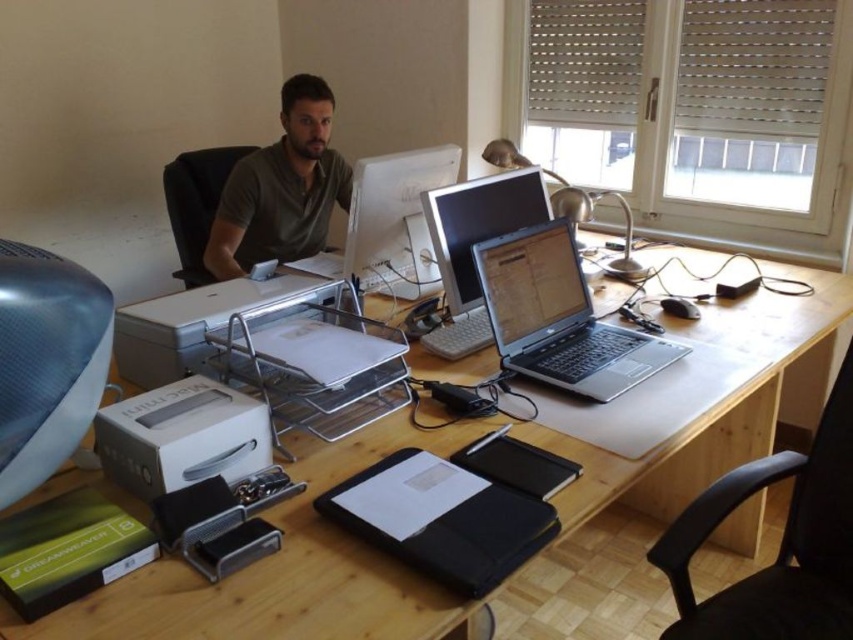
Between point (767, 570) and point (103, 470), which one is positioned behind?

The point (767, 570) is behind.

Is black leather chair at lower right wider than white plastic printer at lower left?

Yes, black leather chair at lower right is wider than white plastic printer at lower left.

Is point (717, 490) behind point (112, 406)?

Yes, it is.

Find the location of a particular element. This screenshot has width=853, height=640. black leather chair at lower right is located at coordinates (780, 541).

Describe the element at coordinates (444, 454) in the screenshot. This screenshot has height=640, width=853. I see `wooden desk at center` at that location.

Is point (426, 634) positioned in front of point (706, 612)?

Yes, it is.

This screenshot has height=640, width=853. Find the location of `wooden desk at center`. wooden desk at center is located at coordinates (444, 454).

The height and width of the screenshot is (640, 853). What do you see at coordinates (444, 454) in the screenshot?
I see `wooden desk at center` at bounding box center [444, 454].

Can you confirm if wooden desk at center is wider than matte white printer at center?

Indeed, wooden desk at center has a greater width compared to matte white printer at center.

Who is more forward, (306, 451) or (189, 291)?

Point (306, 451)

Where is `wooden desk at center`? The image size is (853, 640). wooden desk at center is located at coordinates (444, 454).